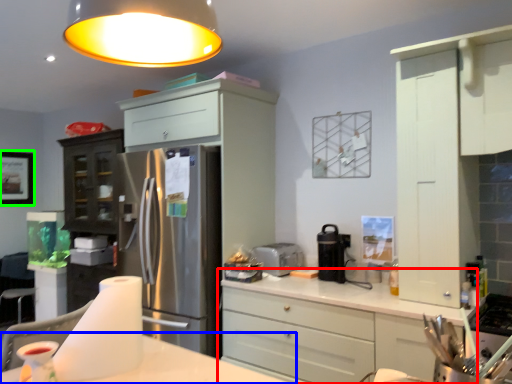
Question: Based on their relative distances, which object is nearer to cabinetry (highlighted by a red box)? Choose from table (highlighted by a blue box) and picture frame (highlighted by a green box).

Choices:
 (A) table
 (B) picture frame

Answer: (A)